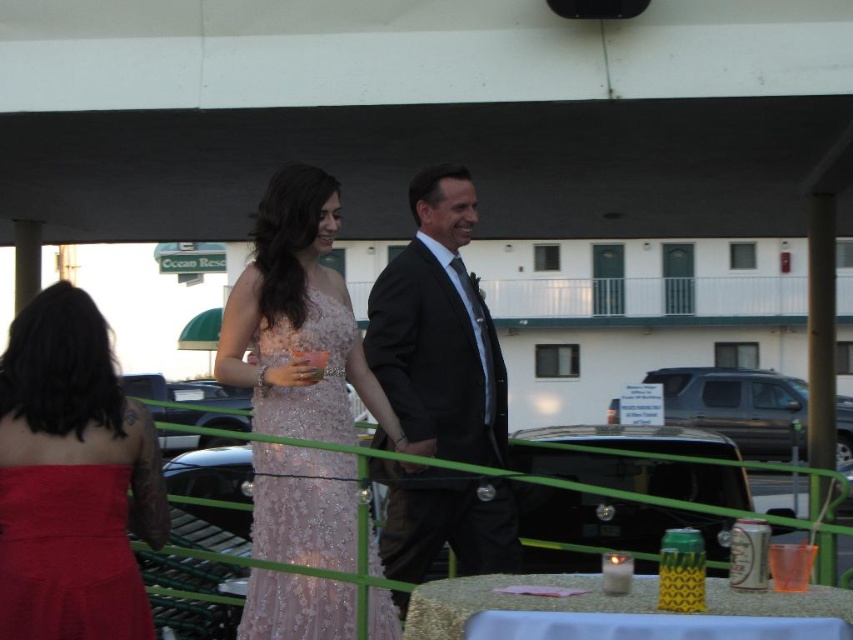
Is sequined pink dress at center below translucent orange cup at lower right?

No, sequined pink dress at center is not below translucent orange cup at lower right.

Is sequined pink dress at center above translucent orange cup at lower right?

Correct, sequined pink dress at center is located above translucent orange cup at lower right.

Who is more forward, (239, 628) or (808, 548)?

Positioned in front is point (808, 548).

The height and width of the screenshot is (640, 853). Identify the location of sequined pink dress at center. (305, 506).

Is point (302, 170) less distant than point (55, 554)?

No, (302, 170) is further to viewer.

Can you confirm if sequined fabric dress at center is wider than matte red dress at lower left?

Correct, the width of sequined fabric dress at center exceeds that of matte red dress at lower left.

The image size is (853, 640). I want to click on sequined fabric dress at center, so click(x=310, y=324).

Where is `sequined fabric dress at center`? sequined fabric dress at center is located at coordinates (310, 324).

Does sequined fabric dress at center appear over matte red dress at left?

Yes, sequined fabric dress at center is above matte red dress at left.

Which is behind, point (459, 460) or point (148, 435)?

The point (459, 460) is behind.

What are the coordinates of `sequined fabric dress at center` in the screenshot? It's located at (310, 324).